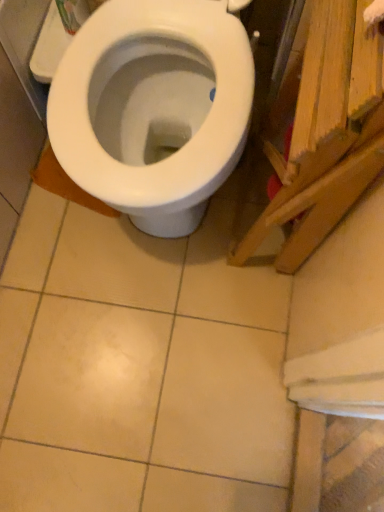
Where is `free point in front of wooden plank at right`? This screenshot has height=512, width=384. free point in front of wooden plank at right is located at coordinates (230, 322).